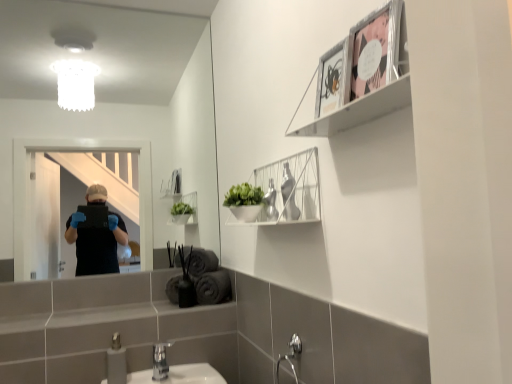
Question: Does clear glass mirror at upper center appear on the left side of metallic silver picture frame at upper right, arranged as the first picture frame when viewed from the left?

Choices:
 (A) no
 (B) yes

Answer: (B)

Question: From the image's perspective, would you say clear glass mirror at upper center is positioned over metallic silver picture frame at upper right, arranged as the first picture frame when viewed from the left?

Choices:
 (A) yes
 (B) no

Answer: (A)

Question: From the image's perspective, does clear glass mirror at upper center appear lower than metallic silver picture frame at upper right, the 2th picture frame when ordered from right to left?

Choices:
 (A) no
 (B) yes

Answer: (A)

Question: Is clear glass mirror at upper center completely or partially outside of metallic silver picture frame at upper right, arranged as the first picture frame when viewed from the left?

Choices:
 (A) no
 (B) yes

Answer: (B)

Question: Considering the relative sizes of clear glass mirror at upper center and metallic silver picture frame at upper right, the 2th picture frame when ordered from right to left, in the image provided, is clear glass mirror at upper center thinner than metallic silver picture frame at upper right, the 2th picture frame when ordered from right to left,?

Choices:
 (A) no
 (B) yes

Answer: (A)

Question: Is clear glass mirror at upper center not near metallic silver picture frame at upper right, arranged as the first picture frame when viewed from the left?

Choices:
 (A) no
 (B) yes

Answer: (B)

Question: Is metallic silver picture frame at upper right, arranged as the first picture frame when viewed from the left, next to brushed metal faucet at lower center and touching it?

Choices:
 (A) yes
 (B) no

Answer: (B)

Question: Is metallic silver picture frame at upper right, arranged as the first picture frame when viewed from the left, aimed at brushed metal faucet at lower center?

Choices:
 (A) yes
 (B) no

Answer: (B)

Question: Considering the relative sizes of metallic silver picture frame at upper right, arranged as the first picture frame when viewed from the left, and brushed metal faucet at lower center in the image provided, is metallic silver picture frame at upper right, arranged as the first picture frame when viewed from the left, smaller than brushed metal faucet at lower center?

Choices:
 (A) no
 (B) yes

Answer: (B)

Question: Is metallic silver picture frame at upper right, the 2th picture frame when ordered from right to left, positioned before brushed metal faucet at lower center?

Choices:
 (A) no
 (B) yes

Answer: (B)

Question: From the image's perspective, does metallic silver picture frame at upper right, arranged as the first picture frame when viewed from the left, appear lower than brushed metal faucet at lower center?

Choices:
 (A) yes
 (B) no

Answer: (B)

Question: Is the depth of metallic silver picture frame at upper right, arranged as the first picture frame when viewed from the left, greater than that of brushed metal faucet at lower center?

Choices:
 (A) yes
 (B) no

Answer: (B)

Question: From the image's perspective, is metallic silver picture frame at upper right, arranged as the first picture frame when viewed from the left, on silver metallic faucet at lower center?

Choices:
 (A) yes
 (B) no

Answer: (A)